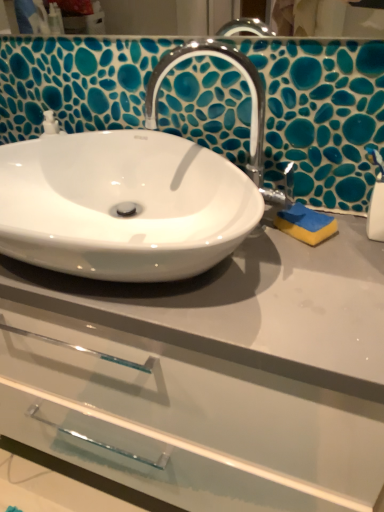
Where is `vacant space situated on the left part of white plastic soap dispenser at right`? The image size is (384, 512). vacant space situated on the left part of white plastic soap dispenser at right is located at coordinates (306, 261).